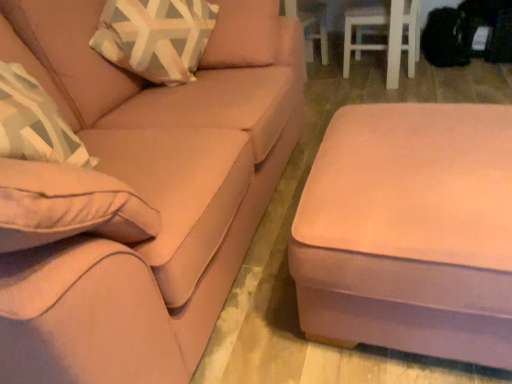
Question: Is suede-like beige couch at center wider than suede ottoman at lower right?

Choices:
 (A) yes
 (B) no

Answer: (A)

Question: Is suede ottoman at lower right a part of suede-like beige couch at center?

Choices:
 (A) yes
 (B) no

Answer: (B)

Question: Is suede-like beige couch at center to the right of suede ottoman at lower right from the viewer's perspective?

Choices:
 (A) yes
 (B) no

Answer: (B)

Question: Does suede-like beige couch at center come in front of suede ottoman at lower right?

Choices:
 (A) yes
 (B) no

Answer: (A)

Question: Is suede-like beige couch at center bigger than suede ottoman at lower right?

Choices:
 (A) yes
 (B) no

Answer: (A)

Question: From a real-world perspective, is suede-like beige couch at center located beneath suede ottoman at lower right?

Choices:
 (A) no
 (B) yes

Answer: (A)

Question: From a real-world perspective, is suede ottoman at lower right under suede-like beige couch at center?

Choices:
 (A) yes
 (B) no

Answer: (A)

Question: From a real-world perspective, is suede ottoman at lower right on top of suede-like beige couch at center?

Choices:
 (A) yes
 (B) no

Answer: (B)

Question: From the image's perspective, would you say suede ottoman at lower right is shown under suede-like beige couch at center?

Choices:
 (A) yes
 (B) no

Answer: (A)

Question: From the image's perspective, is suede ottoman at lower right on top of suede-like beige couch at center?

Choices:
 (A) no
 (B) yes

Answer: (A)

Question: Does suede ottoman at lower right have a lesser height compared to suede-like beige couch at center?

Choices:
 (A) no
 (B) yes

Answer: (B)

Question: Is suede ottoman at lower right outside suede-like beige couch at center?

Choices:
 (A) no
 (B) yes

Answer: (B)

Question: From their relative heights in the image, would you say suede ottoman at lower right is taller or shorter than suede-like beige couch at center?

Choices:
 (A) short
 (B) tall

Answer: (A)